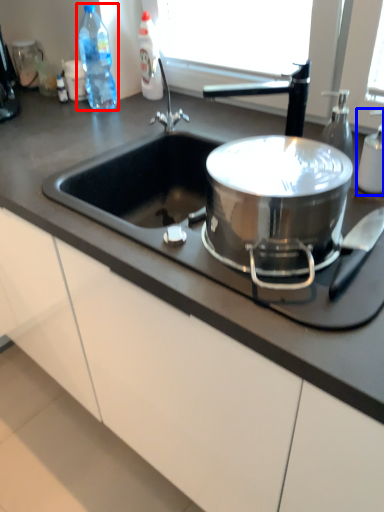
Question: Which object appears closest to the camera in this image, bottle (highlighted by a red box) or bottle (highlighted by a blue box)?

Choices:
 (A) bottle
 (B) bottle

Answer: (B)